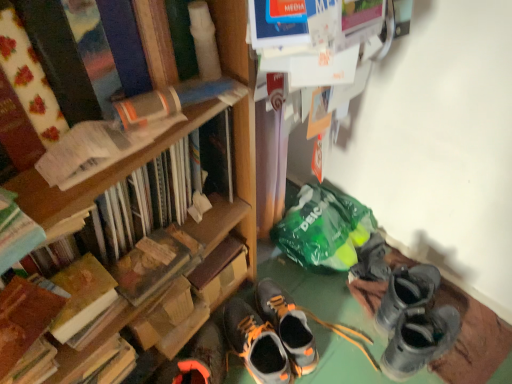
Question: Does hardcover book at left, which appears as the third book when ordered from the bottom, have a greater height compared to hardcover book at left, the fifth book positioned from the bottom?

Choices:
 (A) yes
 (B) no

Answer: (B)

Question: Can you confirm if hardcover book at left, which appears as the third book when ordered from the bottom, is positioned to the right of hardcover book at left, the fifth book positioned from the bottom?

Choices:
 (A) yes
 (B) no

Answer: (B)

Question: Is there a large distance between hardcover book at left, marked as the 3th book in a top-to-bottom arrangement, and hardcover book at left, the fifth book positioned from the bottom?

Choices:
 (A) yes
 (B) no

Answer: (B)

Question: Considering the relative sizes of hardcover book at left, which appears as the third book when ordered from the bottom, and hardcover book at left, the fifth book positioned from the bottom, in the image provided, is hardcover book at left, which appears as the third book when ordered from the bottom, smaller than hardcover book at left, the fifth book positioned from the bottom,?

Choices:
 (A) no
 (B) yes

Answer: (B)

Question: Can you confirm if hardcover book at left, which appears as the third book when ordered from the bottom, is wider than hardcover book at left, the fifth book positioned from the bottom?

Choices:
 (A) no
 (B) yes

Answer: (A)

Question: Visually, is hardcover book at left, which is the fifth book in top-to-bottom order, positioned to the left or to the right of hardcover book at left, the fifth book positioned from the bottom?

Choices:
 (A) left
 (B) right

Answer: (A)

Question: In the image, is hardcover book at left, which is the fifth book in top-to-bottom order, positioned in front of or behind hardcover book at left, which is the 1th book in top-to-bottom order?

Choices:
 (A) behind
 (B) front

Answer: (A)

Question: From a real-world perspective, relative to hardcover book at left, the fifth book positioned from the bottom, is hardcover book at left, marked as the first book in a bottom-to-top arrangement, vertically above or below?

Choices:
 (A) above
 (B) below

Answer: (B)

Question: Is hardcover book at left, which is the fifth book in top-to-bottom order, spatially inside hardcover book at left, which is the 1th book in top-to-bottom order, or outside of it?

Choices:
 (A) inside
 (B) outside

Answer: (B)

Question: Based on their positions, is hardcover book at left, marked as the 4th book in a bottom-to-top arrangement, located to the left or right of hardcover book at left, marked as the 3th book in a top-to-bottom arrangement?

Choices:
 (A) right
 (B) left

Answer: (A)

Question: Considering the positions of hardcover book at left, marked as the 4th book in a bottom-to-top arrangement, and hardcover book at left, which appears as the third book when ordered from the bottom, in the image, is hardcover book at left, marked as the 4th book in a bottom-to-top arrangement, bigger or smaller than hardcover book at left, which appears as the third book when ordered from the bottom,?

Choices:
 (A) small
 (B) big

Answer: (B)

Question: Considering their positions, is hardcover book at left, which appears as the second book when viewed from the top, located in front of or behind hardcover book at left, which appears as the third book when ordered from the bottom?

Choices:
 (A) front
 (B) behind

Answer: (B)

Question: Is hardcover book at left, marked as the 4th book in a bottom-to-top arrangement, inside or outside of hardcover book at left, which appears as the third book when ordered from the bottom?

Choices:
 (A) inside
 (B) outside

Answer: (B)

Question: Considering the positions of point (94, 289) and point (185, 258), is point (94, 289) closer or farther from the camera than point (185, 258)?

Choices:
 (A) closer
 (B) farther

Answer: (A)

Question: Looking at their shapes, would you say hardcover book at left, positioned as the second book in bottom-to-top order, is wider or thinner than hardcover book at center?

Choices:
 (A) wide
 (B) thin

Answer: (B)